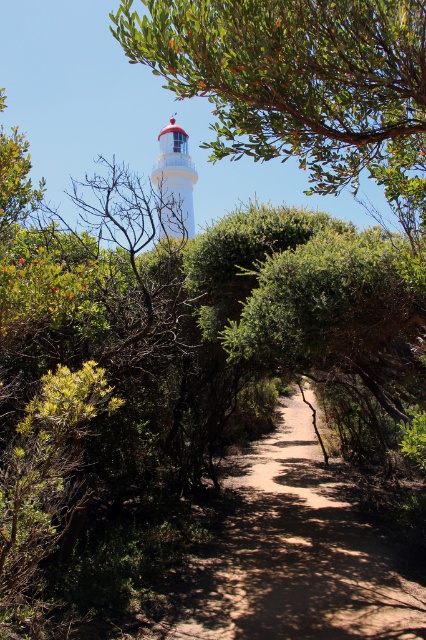
You are standing on the pathway towards the lighthouse and see two points marked on the dirt trail. The first point is at coordinates point [173,634] and the second is at point [160,164]. Which point is closer to you as you walk along the path?

Point [173,634] is closer to the camera than point [160,164], so the first point you mentioned is closer to you as you walk along the path.

You are standing on the pathway and want to reach the white matte lighthouse at upper center. There is a green leafy tree at upper center blocking your view. Can you see the lighthouse from your current position?

The green leafy tree at upper center is located below the white matte lighthouse at upper center, so the tree is below the lighthouse and does not block the view. Therefore, you can see the white matte lighthouse at upper center from your current position.